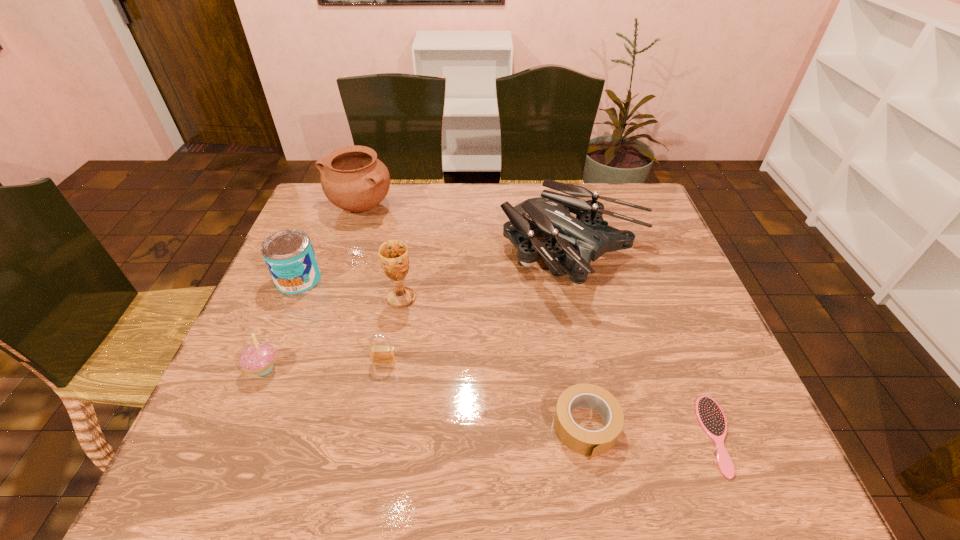
Find the location of a particular element. The width and height of the screenshot is (960, 540). can that is positioned at the left edge is located at coordinates (289, 255).

What are the coordinates of `cupcake that is at the left edge` in the screenshot? It's located at (259, 358).

Locate an element on the screen. The height and width of the screenshot is (540, 960). drone that is at the right edge is located at coordinates (572, 243).

This screenshot has width=960, height=540. What are the coordinates of `hairbrush that is at the right edge` in the screenshot? It's located at click(711, 418).

The image size is (960, 540). I want to click on object present at the far left corner, so click(x=352, y=178).

You are a GUI agent. You are given a task and a screenshot of the screen. Output one action in this format:
    pyautogui.click(x=<x>, y=<y>)
    Task: Click on the object at the far right corner
    
    Given the screenshot: What is the action you would take?
    pyautogui.click(x=572, y=243)

Find the location of a particular element. object that is at the near right corner is located at coordinates (711, 418).

Where is `vacant area at the far edge of the desktop`? vacant area at the far edge of the desktop is located at coordinates (x=431, y=183).

In order to click on vacant area at the near edge in this screenshot , I will do `click(546, 451)`.

The image size is (960, 540). In the image, there is a desktop. In order to click on vacant space at the left edge in this screenshot , I will do `click(307, 356)`.